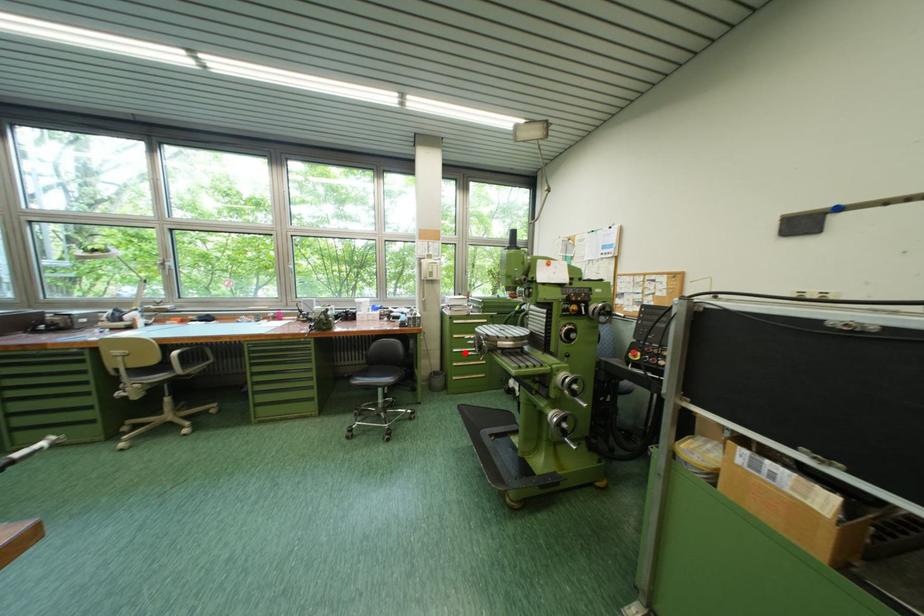
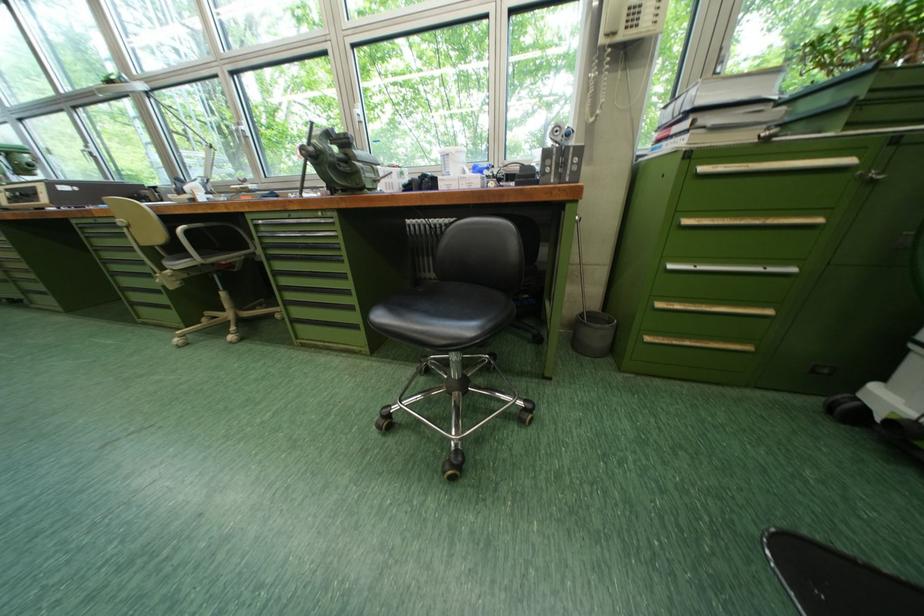
Where in the second image is the point corresponding to the highlighted location from the first image?

(681, 269)